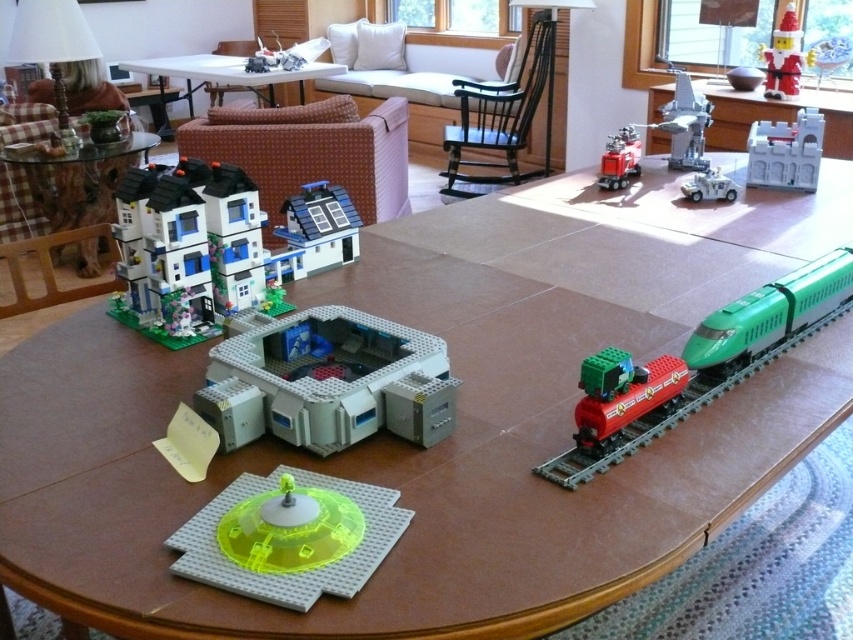
You are standing at the point marked as point (315, 230). What object is located exactly at that point?

The white plastic house at center is located exactly at point (315, 230).